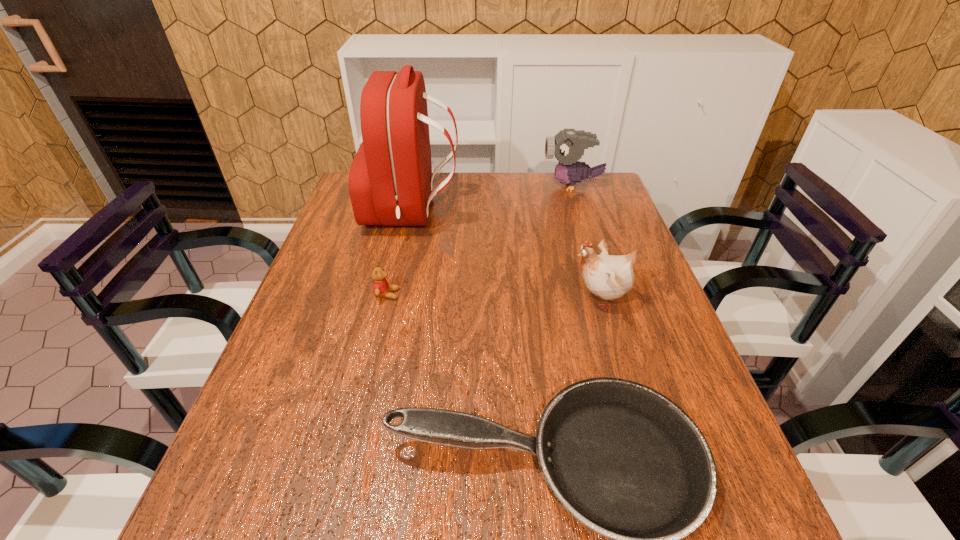
In the image, there is a desktop. What are the coordinates of `vacant space at the far right corner` in the screenshot? It's located at 572,202.

You are a GUI agent. You are given a task and a screenshot of the screen. Output one action in this format:
    pyautogui.click(x=<x>, y=<y>)
    Task: Click on the free space between the farther bird and the backpack
    This screenshot has height=540, width=960.
    Given the screenshot: What is the action you would take?
    pyautogui.click(x=492, y=199)

Locate an element on the screen. free spot between the nearer bird and the teddy bear is located at coordinates (493, 296).

The height and width of the screenshot is (540, 960). Identify the location of free space between the farther bird and the backpack. click(x=492, y=199).

I want to click on vacant region between the tallest object and the teddy bear, so click(x=399, y=254).

You are a GUI agent. You are given a task and a screenshot of the screen. Output one action in this format:
    pyautogui.click(x=<x>, y=<y>)
    Task: Click on the vacant space that's between the nearer bird and the teddy bear
    
    Given the screenshot: What is the action you would take?
    pyautogui.click(x=493, y=296)

You are a GUI agent. You are given a task and a screenshot of the screen. Output one action in this format:
    pyautogui.click(x=<x>, y=<y>)
    Task: Click on the object that can be found as the second closest to the teddy bear
    
    Given the screenshot: What is the action you would take?
    point(627,462)

You are a GUI agent. You are given a task and a screenshot of the screen. Output one action in this format:
    pyautogui.click(x=<x>, y=<y>)
    Task: Click on the object that stands as the closest to the teddy bear
    
    Given the screenshot: What is the action you would take?
    pyautogui.click(x=390, y=181)